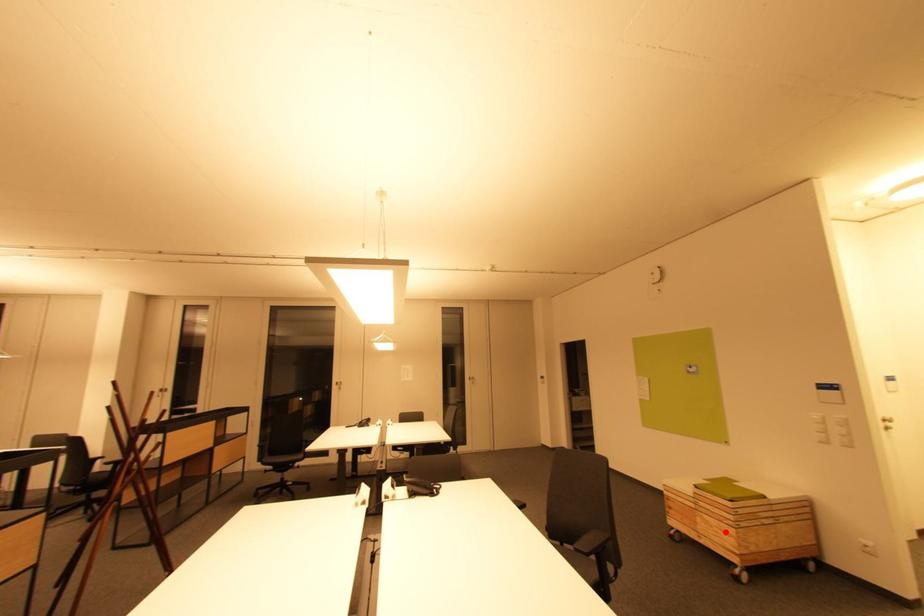
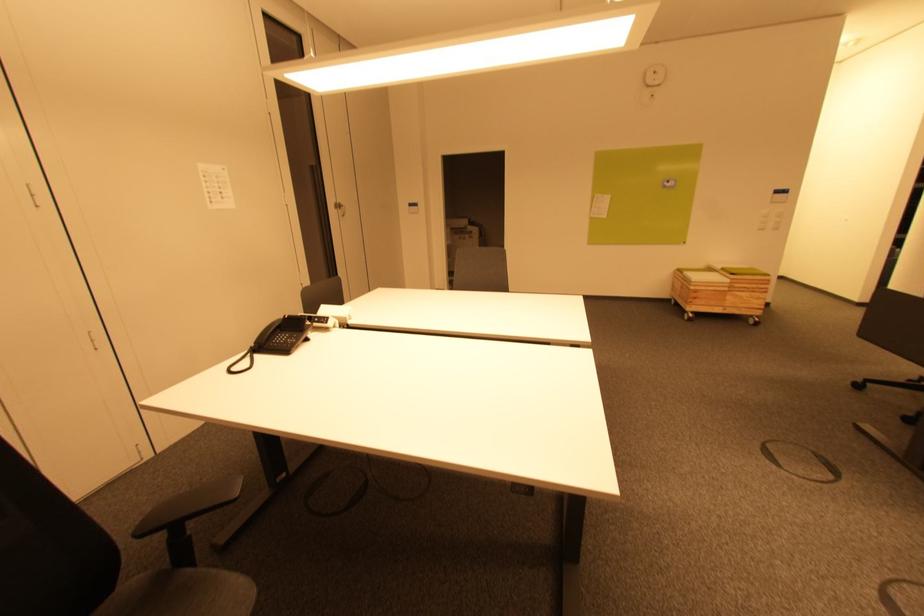
Question: I am providing you with two images of the same scene from different viewpoints. A red point is shown in image1. For the corresponding object point in image2, is it positioned nearer or farther from the camera?

Choices:
 (A) Nearer
 (B) Farther

Answer: (B)